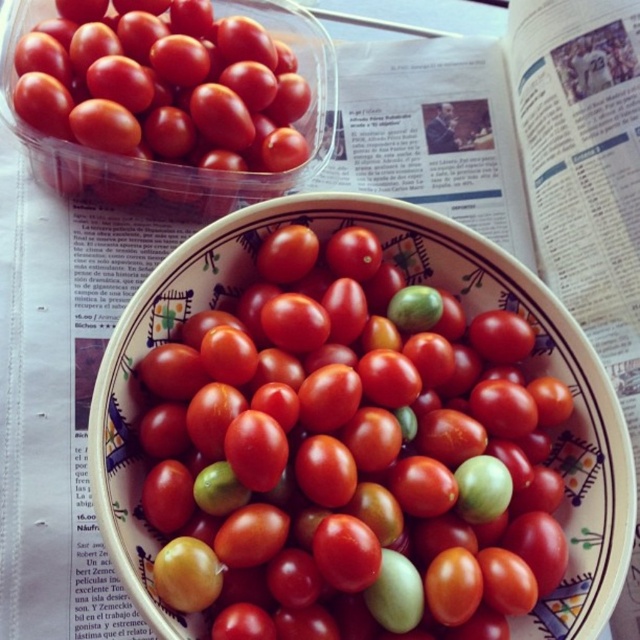
You are trying to determine which object is taller between the green matte cherry tomato at center and the glossy plastic container at upper left. Based on the scene, which one is taller?

The green matte cherry tomato at center is much taller than the glossy plastic container at upper left.

You are looking at the two bowls of cherry tomatoes on the newspaper. If you were to draw a straight line from your eye level to the first point you see, which point would it hit first between point (408, 611) and point (243, 10)?

Point (408, 611) is in front of point (243, 10), so the line would hit point (408, 611) first.

You are arranging fruits on a table and see the green matte cherry tomato at center and the glossy plastic container at upper left. Which object is located to the right of the other?

The green matte cherry tomato at center is positioned to the right of the glossy plastic container at upper left.